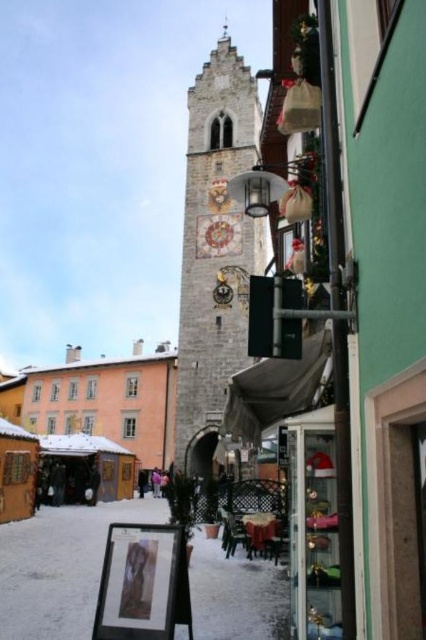
You are an architect assessing the structural integrity of the stone clock tower at center and the orange matte building at center. Based on the scene, which building is taller?

The stone clock tower at center is taller than the orange matte building at center according to the description.

You are a tourist standing in front of the stone clock tower at center and the orange matte building at center. Which one is wider?

The orange matte building at center is wider than the stone clock tower at center.